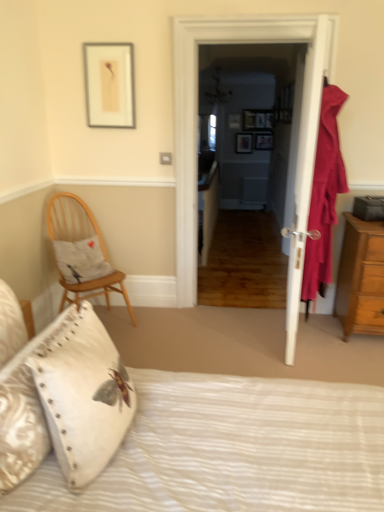
Question: Looking at their shapes, would you say wooden chair with cushion at left is wider or thinner than velvet red curtain at right?

Choices:
 (A) thin
 (B) wide

Answer: (B)

Question: From the image's perspective, is wooden chair with cushion at left above or below velvet red curtain at right?

Choices:
 (A) below
 (B) above

Answer: (A)

Question: Which is nearer to the white textured bed at lower center?

Choices:
 (A) brown wooden chest of drawers at right
 (B) velvet red curtain at right
 (C) wooden chair with cushion at left
 (D) wooden picture frame at upper center, which is the 4th picture frame from back to front
 (E) matte paper picture frame at upper left, the first picture frame when ordered from front to back

Answer: (B)

Question: Which object is positioned closest to the white textured pillow at lower left, which appears as the third pillow when viewed from the back?

Choices:
 (A) matte wooden picture frame at upper center, which is counted as the fourth picture frame, starting from the right
 (B) wooden picture frame at center, which appears as the 2th picture frame when ordered from the bottom
 (C) brown wooden chest of drawers at right
 (D) white wooden door at center
 (E) white textured bed at lower center

Answer: (E)